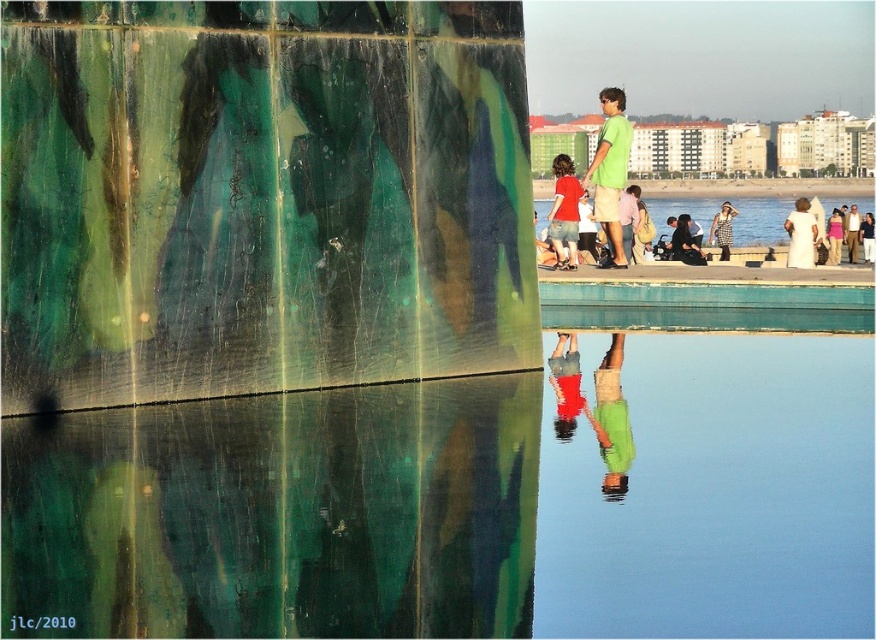
From the picture: You are standing in the urban scene and want to take a photo of both the transparent glass water at center and the white cotton shirt at upper right in the same frame. Can you do this without moving your camera position?

The transparent glass water at center and the white cotton shirt at upper right are 33.45 feet apart. Since this distance is within the camera frame, you can capture both in one photo without moving the camera.

You are a photographer standing in the middle of the scene. You notice the green marble legs at lower center and the green matte shirt at upper center. Which object is closer to the ground?

The green marble legs at lower center is positioned under green matte shirt at upper center, so it is closer to the ground.

You are a construction worker standing at the base of the wall. You need to place a 15 meter long beam between the green marble legs at lower center and the green matte shirt at upper center. Can the beam fit between them?

The distance between the green marble legs at lower center and the green matte shirt at upper center is 17.56 meters, so a 15 meter beam can fit between them since it is shorter than the available space.